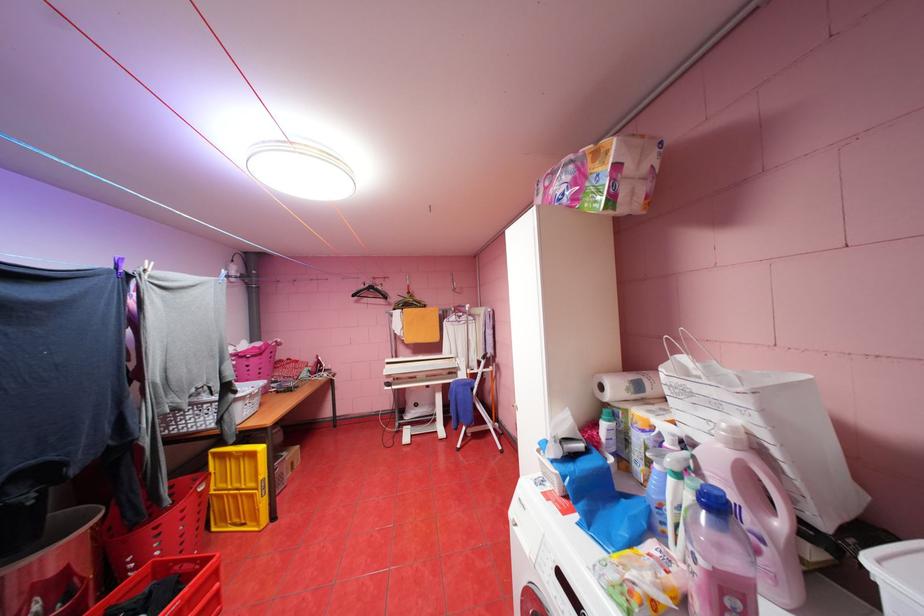
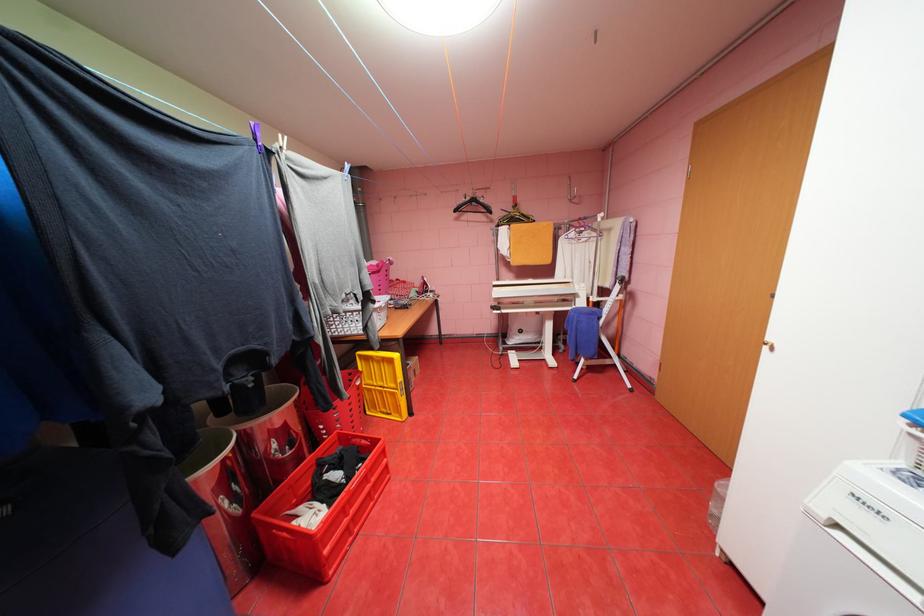
Find the pixel in the second image that matches point 398,304 in the first image.

(500, 221)